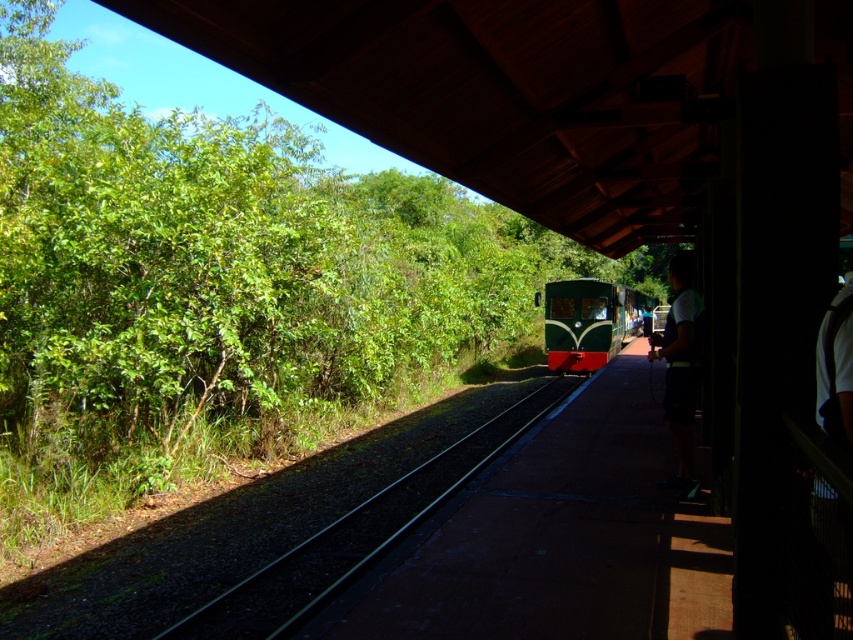
You are a passenger waiting on the platform and see the green gravel track at center and the green matte train at center. Which object is closer to you?

The green gravel track at center is closer to you because it is in front of the green matte train at center.

You are a maintenance worker responsible for ensuring the train fits on the tracks. You observe the green gravel track at center and the green matte train at center. Which one is narrower in width?

The green gravel track at center has a lesser width compared to the green matte train at center, so the green gravel track at center is narrower.